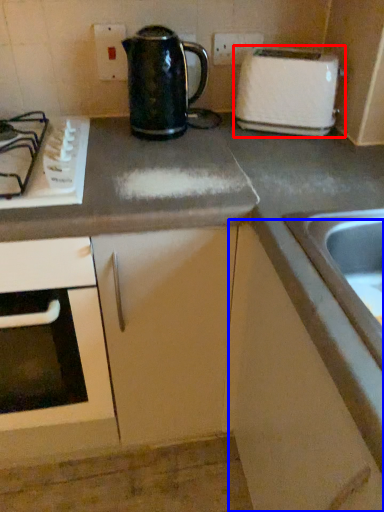
Question: Among these objects, which one is farthest to the camera, toaster (highlighted by a red box) or cabinetry (highlighted by a blue box)?

Choices:
 (A) toaster
 (B) cabinetry

Answer: (A)